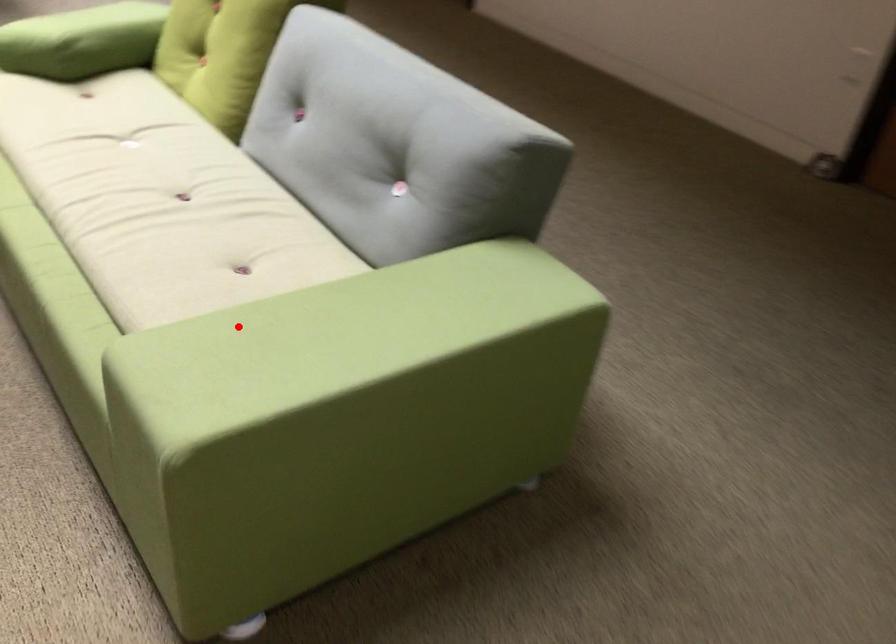
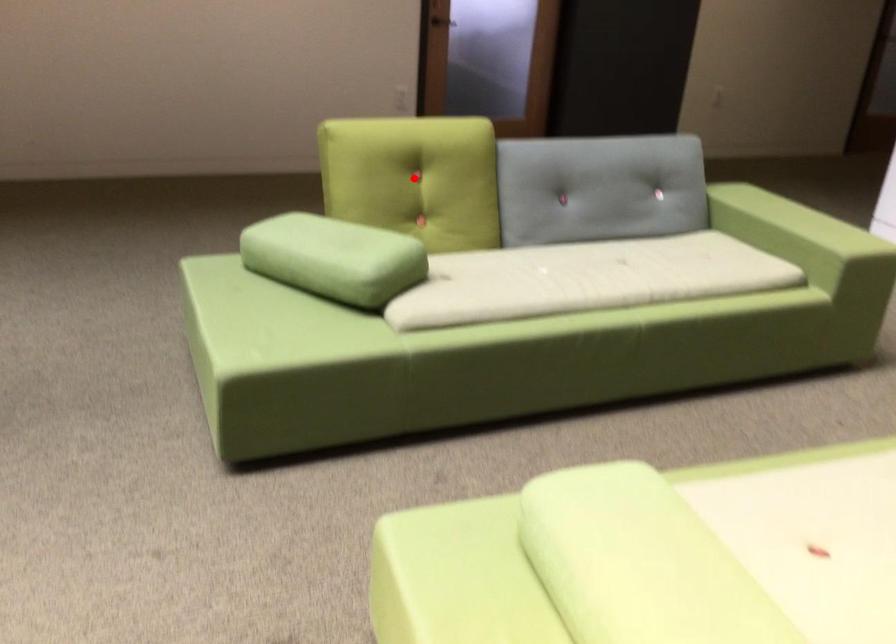
I am providing you with two images of the same scene from different viewpoints. A red point is marked on the first image and another point is marked on the second image. Is the red point in image1 aligned with the point shown in image2?

No